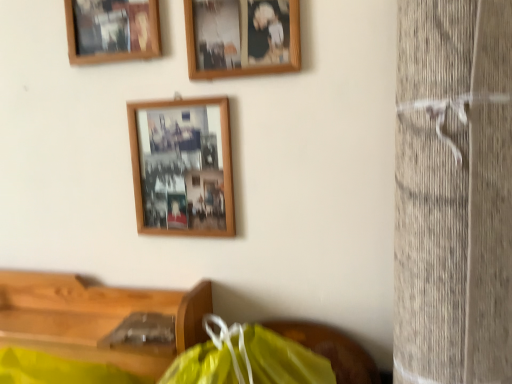
Question: In which direction should I rotate to look at wooden photo frame at center, which appears as the third picture frame when viewed from the top?

Choices:
 (A) right
 (B) left

Answer: (B)

Question: Does wooden picture frame at upper left, positioned as the 3th picture frame in bottom-to-top order, turn towards wooden table at lower left?

Choices:
 (A) yes
 (B) no

Answer: (B)

Question: Is wooden picture frame at upper left, acting as the 1th picture frame starting from the top, positioned beyond the bounds of wooden table at lower left?

Choices:
 (A) no
 (B) yes

Answer: (B)

Question: Does wooden picture frame at upper left, positioned as the 3th picture frame in bottom-to-top order, have a lesser height compared to wooden table at lower left?

Choices:
 (A) no
 (B) yes

Answer: (A)

Question: Considering the relative positions of wooden picture frame at upper left, acting as the 1th picture frame starting from the top, and wooden table at lower left in the image provided, is wooden picture frame at upper left, acting as the 1th picture frame starting from the top, in front of wooden table at lower left?

Choices:
 (A) yes
 (B) no

Answer: (B)

Question: Does wooden picture frame at upper left, positioned as the 3th picture frame in bottom-to-top order, have a greater width compared to wooden table at lower left?

Choices:
 (A) yes
 (B) no

Answer: (B)

Question: Considering the relative sizes of wooden picture frame at upper left, positioned as the 3th picture frame in bottom-to-top order, and wooden table at lower left in the image provided, is wooden picture frame at upper left, positioned as the 3th picture frame in bottom-to-top order, thinner than wooden table at lower left?

Choices:
 (A) yes
 (B) no

Answer: (A)

Question: Considering the relative sizes of wooden table at lower left and wooden picture frame at upper left, positioned as the 3th picture frame in bottom-to-top order, in the image provided, is wooden table at lower left wider than wooden picture frame at upper left, positioned as the 3th picture frame in bottom-to-top order,?

Choices:
 (A) no
 (B) yes

Answer: (B)

Question: Considering the relative sizes of wooden table at lower left and wooden picture frame at upper left, acting as the 1th picture frame starting from the top, in the image provided, is wooden table at lower left shorter than wooden picture frame at upper left, acting as the 1th picture frame starting from the top,?

Choices:
 (A) yes
 (B) no

Answer: (A)

Question: Is wooden table at lower left bigger than wooden picture frame at upper left, positioned as the 3th picture frame in bottom-to-top order?

Choices:
 (A) yes
 (B) no

Answer: (A)

Question: From a real-world perspective, is wooden table at lower left beneath wooden picture frame at upper left, acting as the 1th picture frame starting from the top?

Choices:
 (A) yes
 (B) no

Answer: (A)

Question: Can you confirm if wooden table at lower left is taller than wooden picture frame at upper left, positioned as the 3th picture frame in bottom-to-top order?

Choices:
 (A) yes
 (B) no

Answer: (B)

Question: Considering the relative sizes of wooden table at lower left and wooden picture frame at upper left, positioned as the 3th picture frame in bottom-to-top order, in the image provided, is wooden table at lower left thinner than wooden picture frame at upper left, positioned as the 3th picture frame in bottom-to-top order,?

Choices:
 (A) yes
 (B) no

Answer: (B)

Question: Is wooden table at lower left placed right next to wooden photo frame at upper center, the second picture frame when ordered from top to bottom?

Choices:
 (A) no
 (B) yes

Answer: (A)